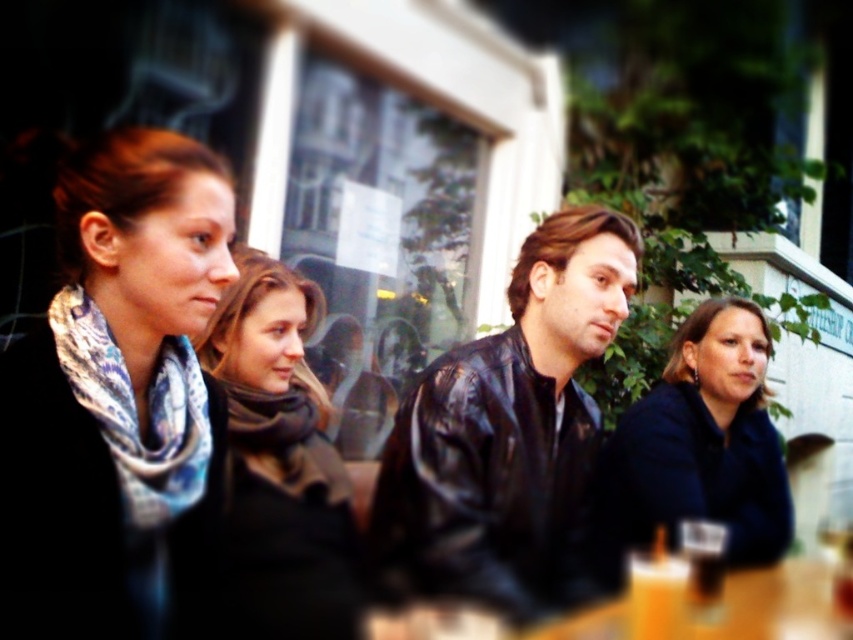
You are a tailor who needs to determine which scarf requires more fabric for a custom order. Given the printed scarf at left and the dark gray wool scarf at center, which one would need more fabric based on their sizes?

The printed scarf at left requires more fabric because its width is larger than the dark gray wool scarf at center.

You are standing in front of the table at the scene. There are two points marked on the table surface. The first point is at coordinate point (633, 532) and the second point is at coordinate point (263, 456). Which point is closer to you?

Point (263, 456) is closer to you because it is less further to the camera than point (633, 532).

You are taking a photo of the group and want to focus on the person closest to the camera. Which point should you focus on, point [654,436] or point [726,620]?

Point [654,436] is further to the camera than point [726,620], so you should focus on point [654,436] to capture the person closest to the camera.